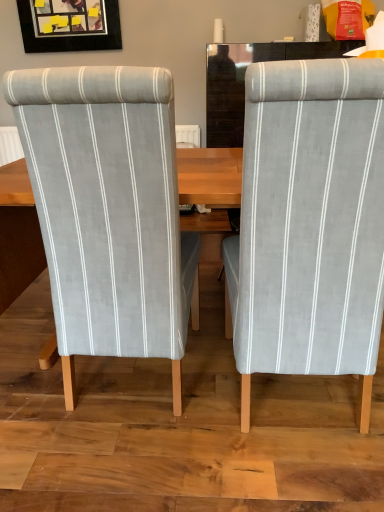
Locate an element on the screen. vacant region in front of light gray fabric chair at right, which is the second chair in left-to-right order is located at coordinates (279, 476).